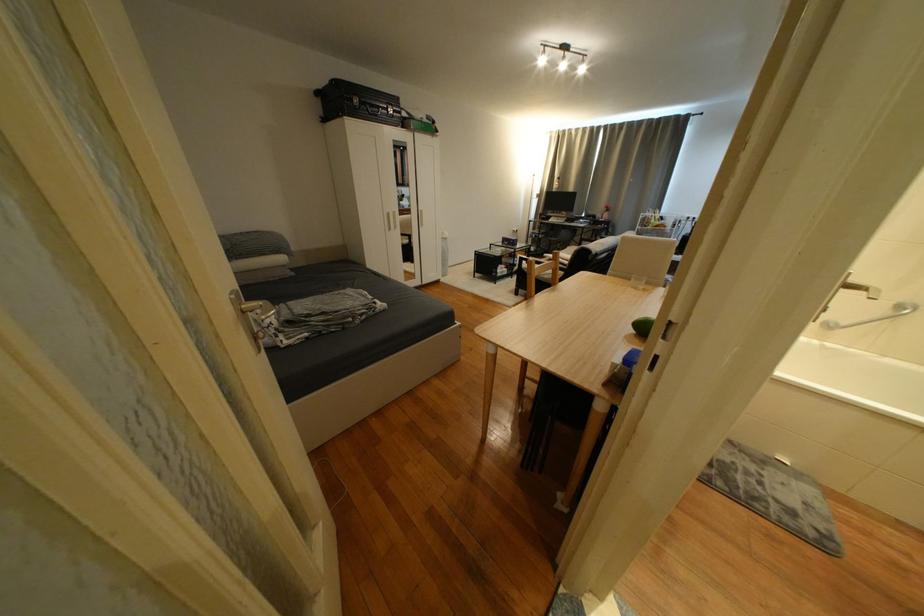
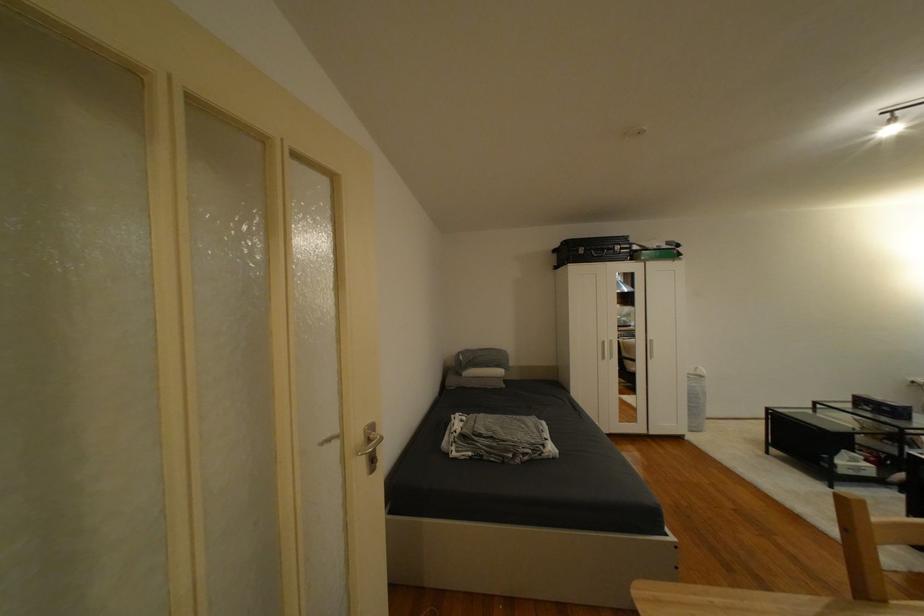
Find the pixel in the second image that matches point (396, 216) in the first image.

(612, 344)